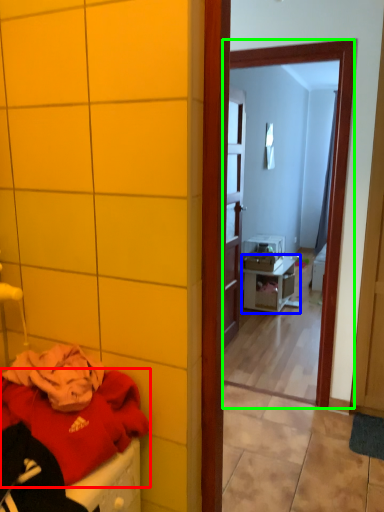
Question: Considering the real-world distances, which object is farthest from clothing (highlighted by a red box)? nightstand (highlighted by a blue box) or mirror (highlighted by a green box)?

Choices:
 (A) nightstand
 (B) mirror

Answer: (A)